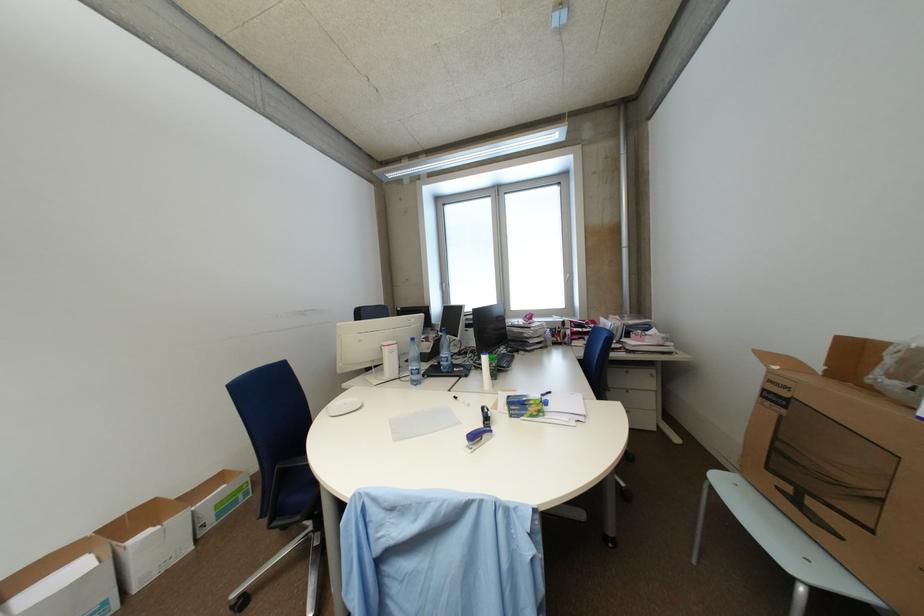
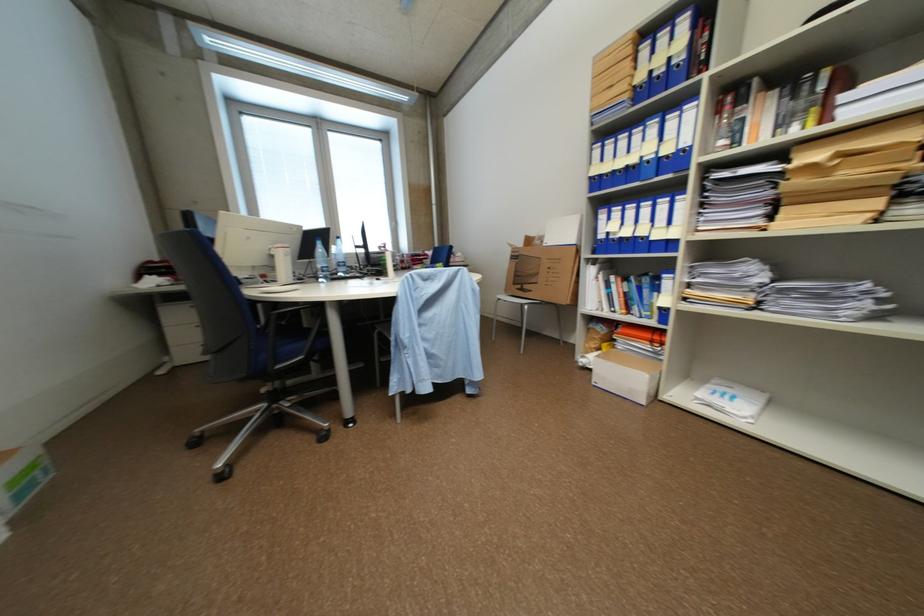
Where in the second image is the point corresponding to the point at 227,516 from the first image?

(28, 496)